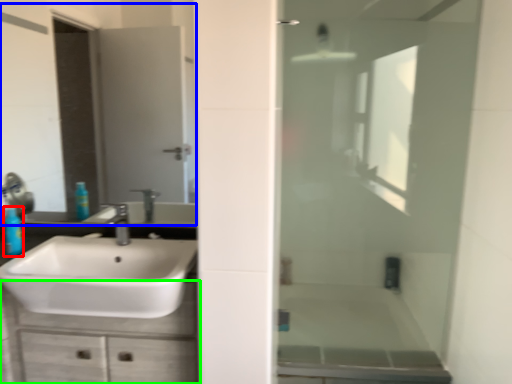
Question: Based on their relative distances, which object is farther from toiletry (highlighted by a red box)? Choose from mirror (highlighted by a blue box) and bathroom cabinet (highlighted by a green box).

Choices:
 (A) mirror
 (B) bathroom cabinet

Answer: (A)